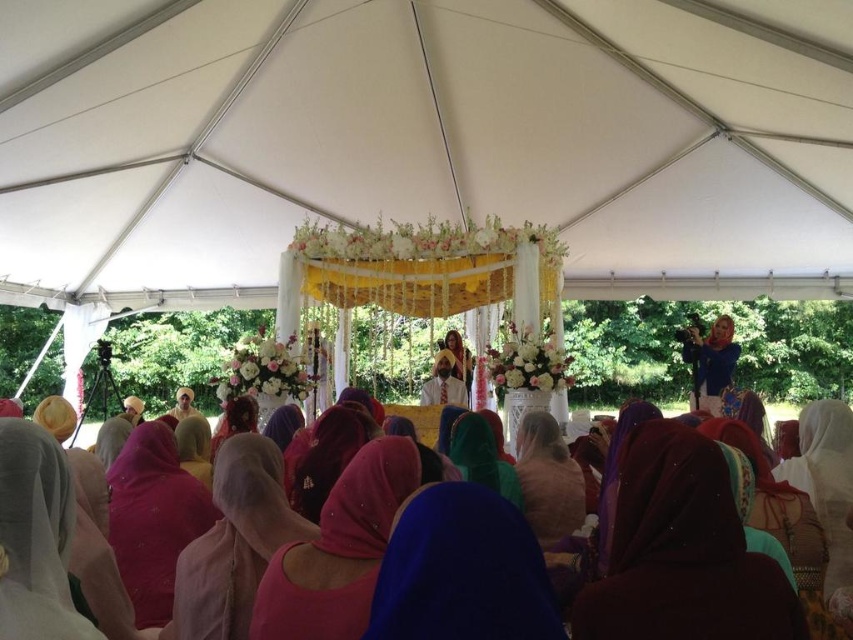
You are a photographer at the event and want to capture a photo that includes both the blue fabric headscarf at center and the pink satin dupatta at lower left. Which one should you focus on first to ensure both are in the frame?

You should focus on the blue fabric headscarf at center first because it is in front of the pink satin dupatta at lower left, so positioning the camera to include the foreground object will naturally include the background one as well.

You are a photographer positioned at the back of the tent and want to capture a clear shot of both the blue fabric headscarf at center and the matte pink veil at center. Which object will appear larger in your photo?

The blue fabric headscarf at center will appear larger in the photo because it is closer to the photographer than the matte pink veil at center.